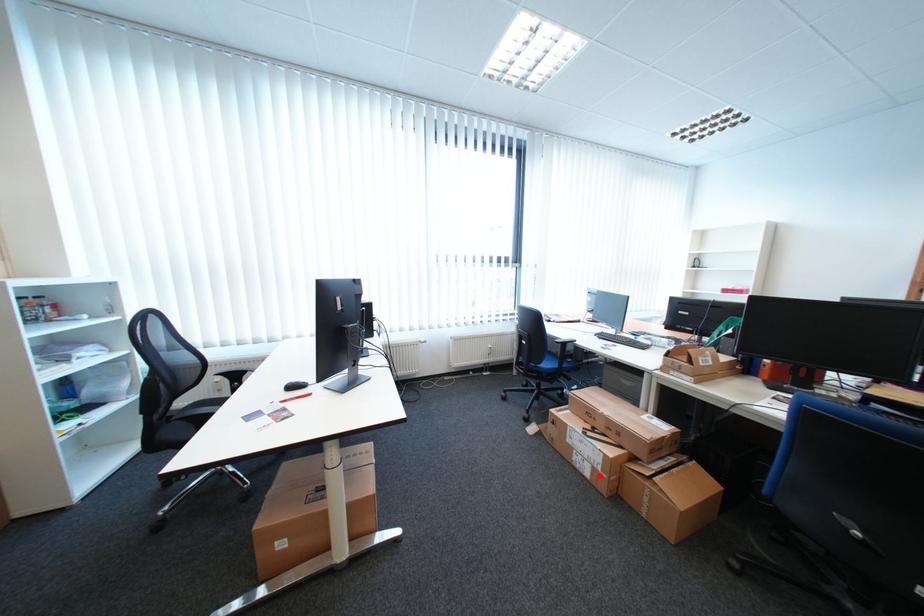
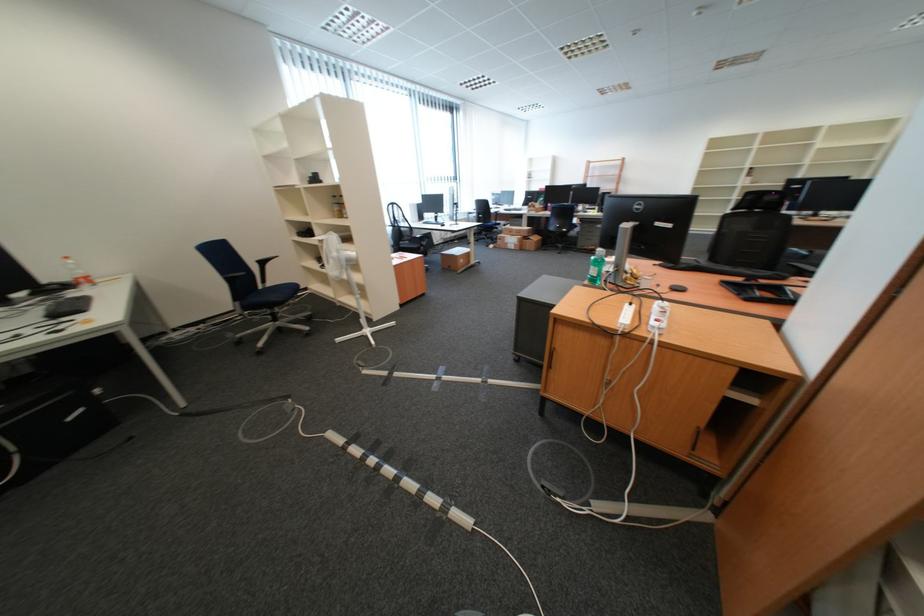
Question: I am providing you with two images of the same scene from different viewpoints. A red point is shown in image1. For the corresponding object point in image2, is it positioned nearer or farther from the camera?

Choices:
 (A) Nearer
 (B) Farther

Answer: (A)